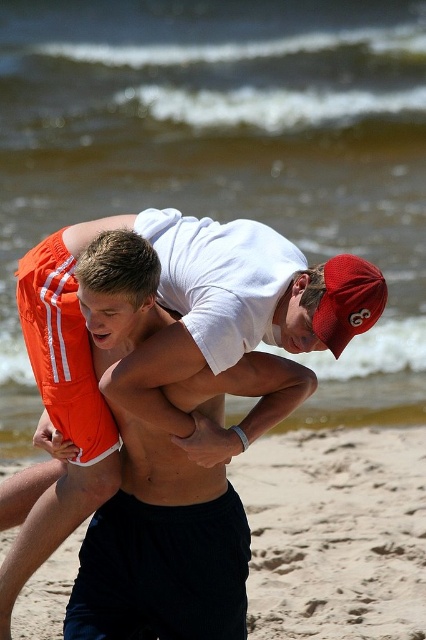
You are a photographer trying to capture the entire scene of the sandy beach at lower center and the red mesh baseball cap at upper right in one shot. Based on their sizes, which object should you focus on to ensure both are visible without cropping?

The sandy beach at lower center is larger in size compared to the red mesh baseball cap at upper right. To capture both in one shot, focus on the sandy beach at lower center as it occupies more space, ensuring the smaller red mesh baseball cap at upper right is also within the frame.

Looking at this image, you are standing at the camera position and want to throw a ball to both the point at coordinates point (276, 625) and the point at coordinates point (353, 289). Which point should you aim for first if you want to reach the closer one first?

You should aim for point (353, 289) first because it is closer to you than point (276, 625), which is further away.